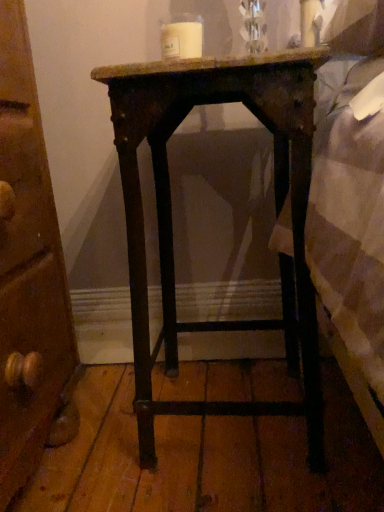
Question: Could you tell me if wooden nightstand at center is facing white matte candle at upper center?

Choices:
 (A) yes
 (B) no

Answer: (B)

Question: Is wooden nightstand at center further to camera compared to white matte candle at upper center?

Choices:
 (A) no
 (B) yes

Answer: (A)

Question: Are wooden nightstand at center and white matte candle at upper center far apart?

Choices:
 (A) yes
 (B) no

Answer: (B)

Question: Is wooden nightstand at center to the right of white matte candle at upper center from the viewer's perspective?

Choices:
 (A) yes
 (B) no

Answer: (A)

Question: From the image's perspective, is wooden nightstand at center on white matte candle at upper center?

Choices:
 (A) no
 (B) yes

Answer: (A)

Question: Can you confirm if wooden nightstand at center is taller than white matte candle at upper center?

Choices:
 (A) yes
 (B) no

Answer: (A)

Question: Is wooden nightstand at center at the back of white matte candle at upper center?

Choices:
 (A) no
 (B) yes

Answer: (A)

Question: Is white matte candle at upper center aimed at wooden nightstand at center?

Choices:
 (A) yes
 (B) no

Answer: (B)

Question: Is white matte candle at upper center directly adjacent to wooden nightstand at center?

Choices:
 (A) yes
 (B) no

Answer: (B)

Question: Is white matte candle at upper center positioned beyond the bounds of wooden nightstand at center?

Choices:
 (A) yes
 (B) no

Answer: (A)

Question: From the image's perspective, is white matte candle at upper center above wooden nightstand at center?

Choices:
 (A) no
 (B) yes

Answer: (B)

Question: Is white matte candle at upper center smaller than wooden nightstand at center?

Choices:
 (A) no
 (B) yes

Answer: (B)

Question: Is wooden nightstand at center taller or shorter than white matte candle at upper center?

Choices:
 (A) short
 (B) tall

Answer: (B)